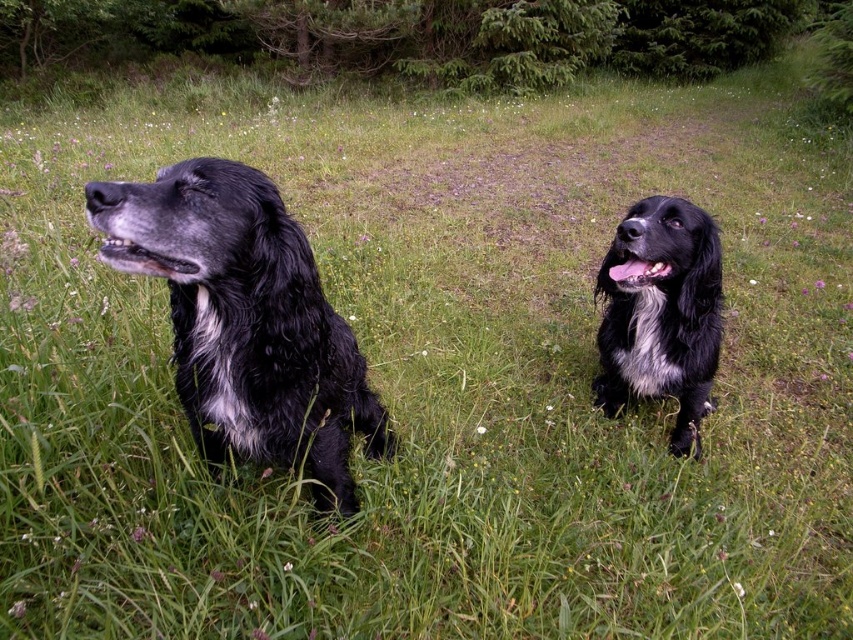
You are standing at the point marked as point (245, 321) in the image. Looking around, you see shiny black fur at left. What direction should you face to see the shiny black fur at left?

You should face to the left to see the shiny black fur at left.

You are a photographer standing in front of the two dogs. You want to take a photo where the shiny black fur at left is visible above the black fluffy dog at right. Is this possible with their current positions?

The shiny black fur at left is positioned under the black fluffy dog at right, so it cannot be visible above it in the current arrangement.